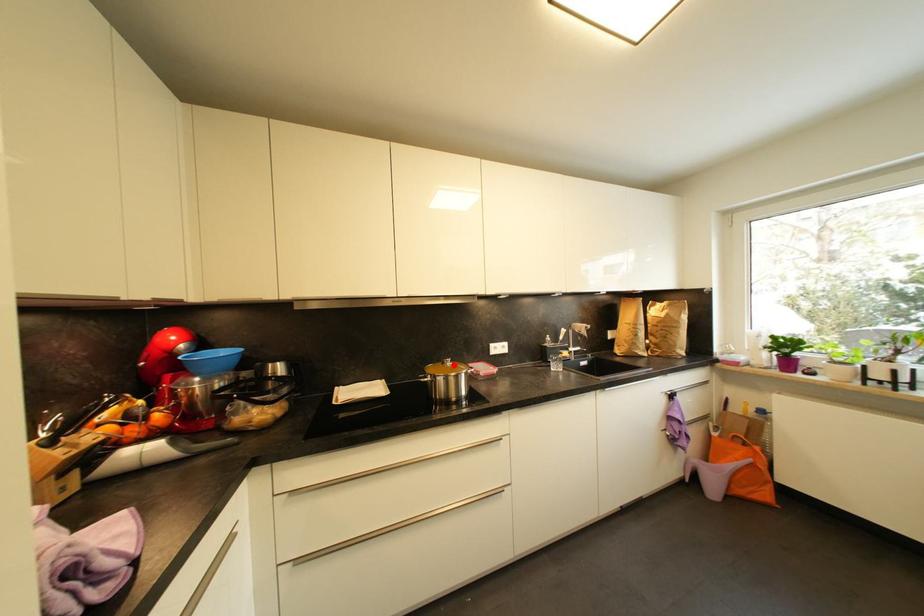
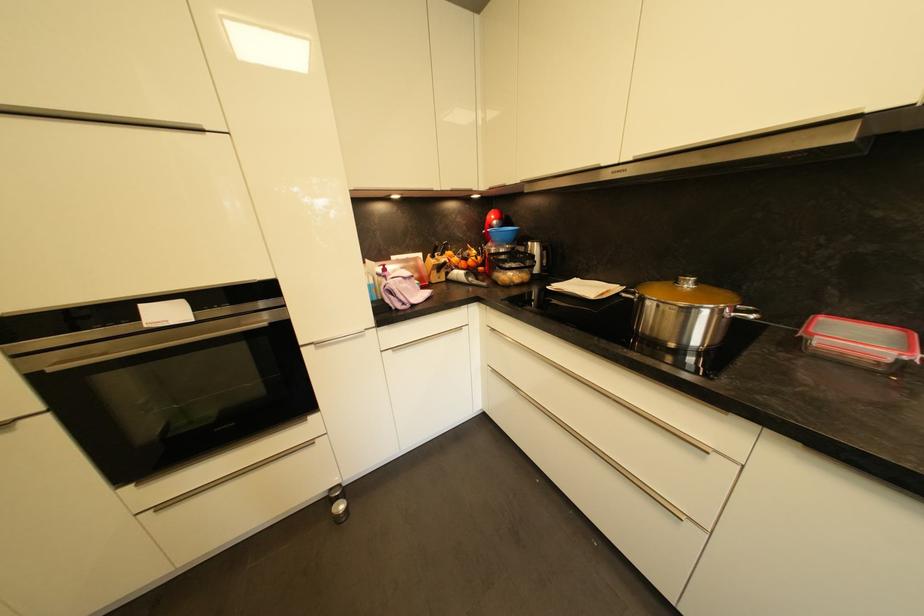
Find the pixel in the second image that matches the highlighted location in the first image.

(694, 286)